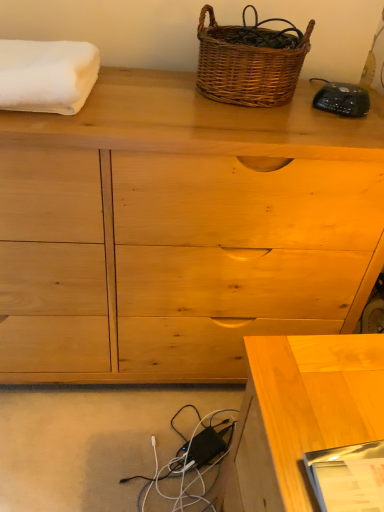
Where is `free location to the right of white fluffy towel at upper left`? Image resolution: width=384 pixels, height=512 pixels. free location to the right of white fluffy towel at upper left is located at coordinates (150, 103).